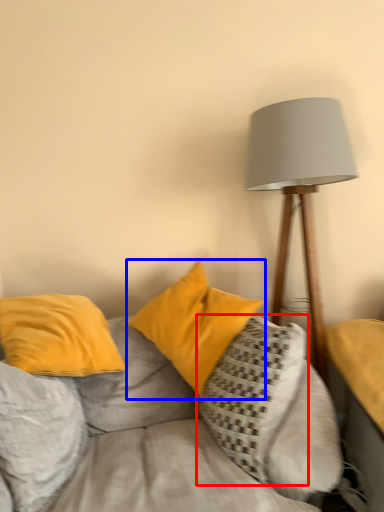
Question: Which of the following is the farthest to the observer, pillow (highlighted by a red box) or pillow (highlighted by a blue box)?

Choices:
 (A) pillow
 (B) pillow

Answer: (B)